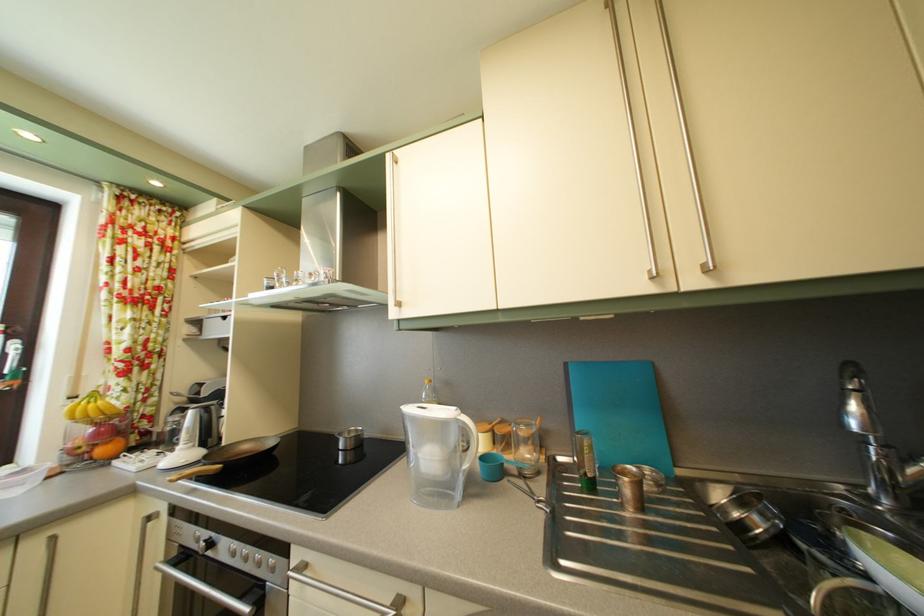
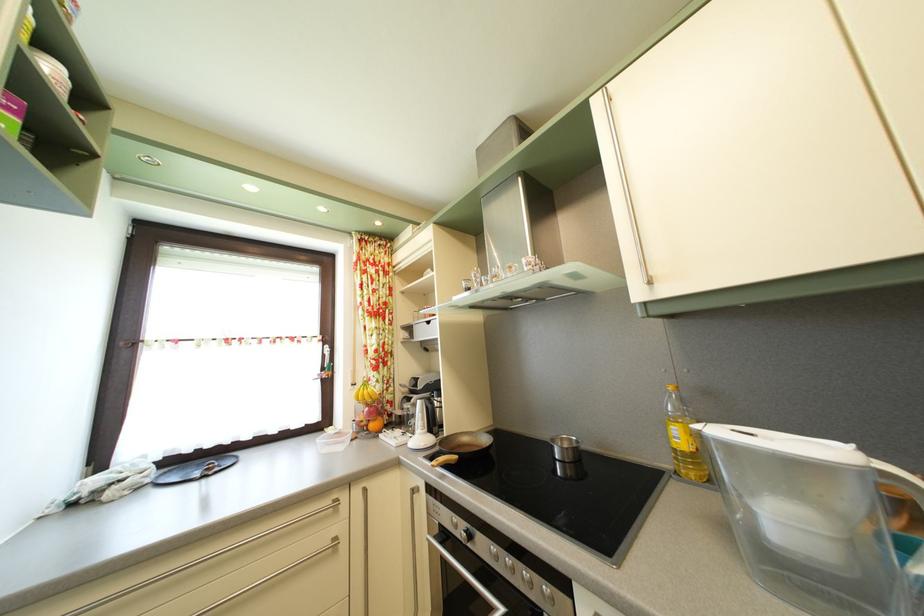
Locate, in the second image, the point that corresponds to point 358,439 in the first image.

(569, 448)